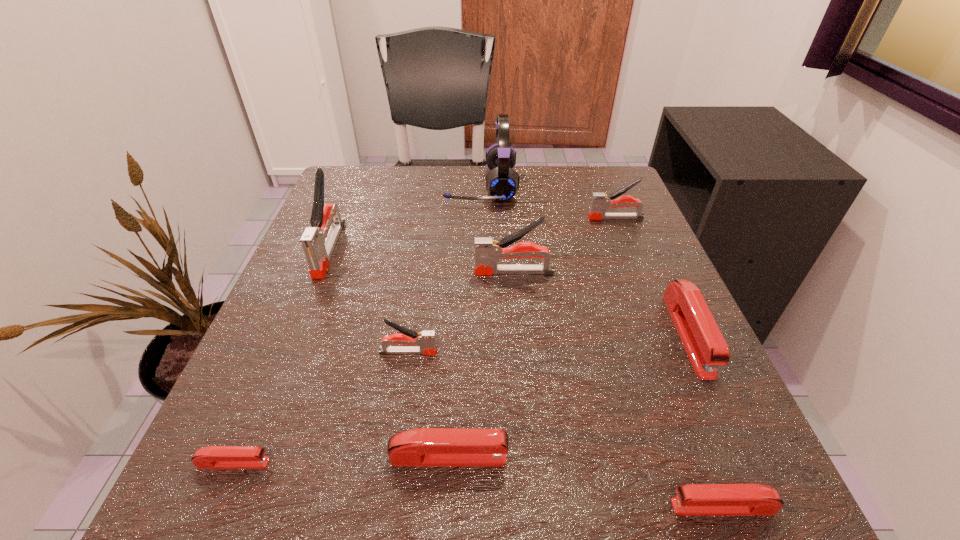
What are the coordinates of `vacant space situated 0.210m on the handle side of the second biggest gray stapler` in the screenshot? It's located at (365, 272).

The height and width of the screenshot is (540, 960). In order to click on vacant space located on the handle side of the second biggest gray stapler in this screenshot , I will do `click(328, 272)`.

At what (x,y) coordinates should I click in order to perform the action: click on free point located 0.140m on the handle side of the second biggest gray stapler. Please return your answer as a coordinate pair (x, y). Looking at the image, I should click on (401, 272).

Find the location of a particular element. vacant space situated on the handle side of the third biggest gray stapler is located at coordinates (408, 218).

Locate an element on the screen. vacant space located on the handle side of the third biggest gray stapler is located at coordinates (418, 218).

Image resolution: width=960 pixels, height=540 pixels. In order to click on vacant space situated 0.170m on the handle side of the third biggest gray stapler in this screenshot , I will do pyautogui.click(x=512, y=218).

You are a GUI agent. You are given a task and a screenshot of the screen. Output one action in this format:
    pyautogui.click(x=<x>, y=<y>)
    Task: Click on the vacant area situated 0.350m on the handle side of the nearest gray stapler
    Image resolution: width=960 pixels, height=540 pixels.
    Given the screenshot: What is the action you would take?
    pyautogui.click(x=657, y=352)

The image size is (960, 540). Identify the location of vacant area situated 0.050m on the front-facing side of the biggest red stapler. (722, 410).

Where is `vacant position located on the front-facing side of the second red stapler from left to right`? This screenshot has width=960, height=540. vacant position located on the front-facing side of the second red stapler from left to right is located at coordinates (753, 457).

This screenshot has width=960, height=540. I want to click on vacant space located on the front-facing side of the second smallest red stapler, so click(x=455, y=507).